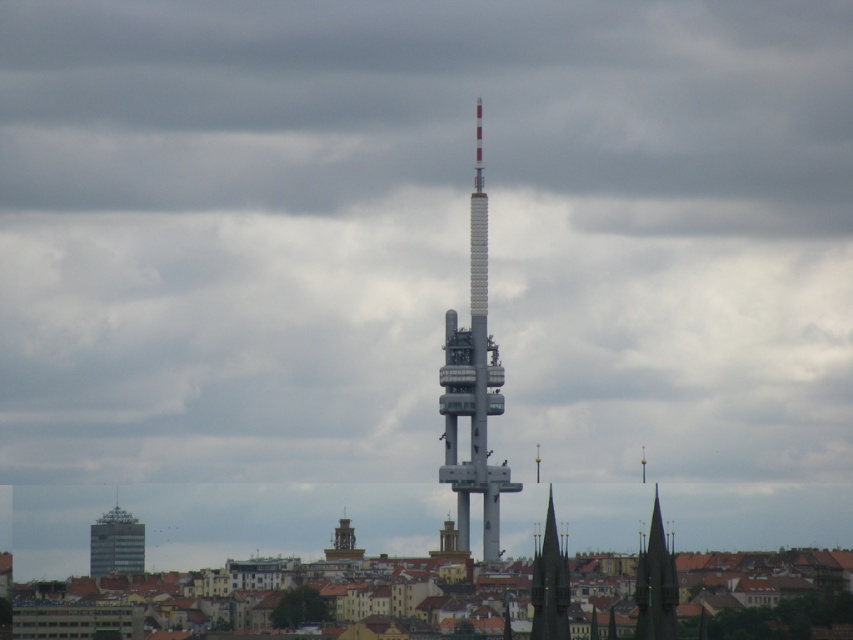
Question: Is matte gray building at lower left smaller than golden stone clock tower at center?

Choices:
 (A) yes
 (B) no

Answer: (B)

Question: Is dark green stone spire at lower right below dark gray stone spire at lower center?

Choices:
 (A) yes
 (B) no

Answer: (A)

Question: Based on their relative distances, which object is nearer to the golden stone clock tower at center?

Choices:
 (A) white metallic tower at center
 (B) matte gray building at lower left
 (C) dark green stone spire at lower right

Answer: (A)

Question: From the image, what is the correct spatial relationship of dark green stone spire at lower right in relation to golden stone clock tower at center?

Choices:
 (A) below
 (B) above

Answer: (A)

Question: Which point is closer to the camera taking this photo?

Choices:
 (A) (140, 563)
 (B) (531, 588)
 (C) (498, 401)
 (D) (669, 557)

Answer: (C)

Question: Which of the following is the closest to the observer?

Choices:
 (A) dark gray stone spire at lower center
 (B) white metallic tower at center

Answer: (B)